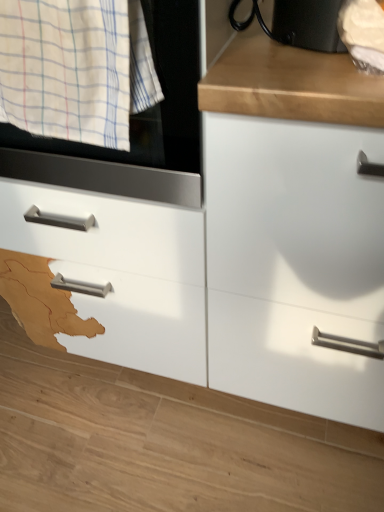
What are the coordinates of `free spot below white checkered cloth at left (from a real-world perspective)` in the screenshot? It's located at tap(132, 413).